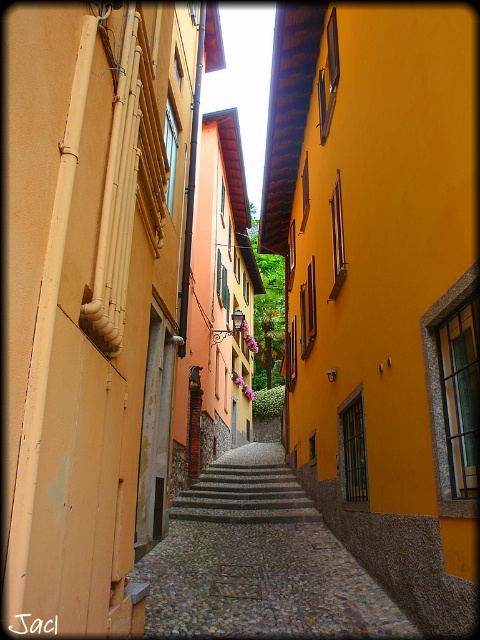
Question: Among these objects, which one is nearest to the camera?

Choices:
 (A) gray stone stairs at center
 (B) cobblestone path at center

Answer: (B)

Question: Which of the following is the farthest from the observer?

Choices:
 (A) tap(254, 616)
 (B) tap(218, 492)

Answer: (B)

Question: Is cobblestone path at center positioned behind gray stone stairs at center?

Choices:
 (A) no
 (B) yes

Answer: (A)

Question: Considering the relative positions of cobblestone path at center and gray stone stairs at center in the image provided, where is cobblestone path at center located with respect to gray stone stairs at center?

Choices:
 (A) right
 (B) left

Answer: (A)

Question: Does cobblestone path at center appear over gray stone stairs at center?

Choices:
 (A) yes
 (B) no

Answer: (A)